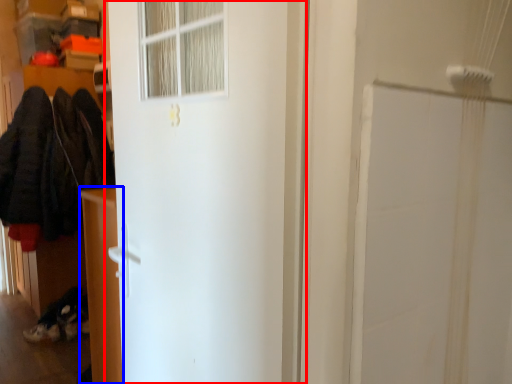
Question: Among these objects, which one is farthest to the camera, door (highlighted by a red box) or furniture (highlighted by a blue box)?

Choices:
 (A) door
 (B) furniture

Answer: (B)